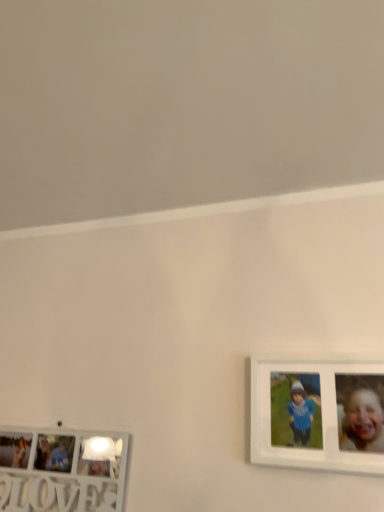
What do you see at coordinates (318, 414) in the screenshot?
I see `white matte picture frame at right, positioned as the 2th picture frame in bottom-to-top order` at bounding box center [318, 414].

Measure the distance between point (288, 449) and camera.

The depth of point (288, 449) is 1.00 meters.

In order to click on white matte picture frame at right, which ranks as the 1th picture frame in top-to-bottom order in this screenshot , I will do point(318,414).

How much space does white wooden picture frame at lower left, which is the first picture frame in left-to-right order, occupy vertically?

white wooden picture frame at lower left, which is the first picture frame in left-to-right order, is 24.23 centimeters tall.

The height and width of the screenshot is (512, 384). I want to click on white wooden picture frame at lower left, which is the first picture frame in left-to-right order, so click(62, 470).

What do you see at coordinates (62, 470) in the screenshot? I see `white wooden picture frame at lower left, which is the first picture frame in left-to-right order` at bounding box center [62, 470].

The height and width of the screenshot is (512, 384). In order to click on white matte picture frame at right, the 1th picture frame viewed from the right in this screenshot , I will do `click(318, 414)`.

Can you confirm if white wooden picture frame at lower left, which is the 2th picture frame from top to bottom, is positioned to the right of white matte picture frame at right, which ranks as the 1th picture frame in top-to-bottom order?

Incorrect, white wooden picture frame at lower left, which is the 2th picture frame from top to bottom, is not on the right side of white matte picture frame at right, which ranks as the 1th picture frame in top-to-bottom order.

Considering the positions of objects white wooden picture frame at lower left, which is the 1th picture frame from bottom to top, and white matte picture frame at right, positioned as the 2th picture frame in bottom-to-top order, in the image provided, who is in front, white wooden picture frame at lower left, which is the 1th picture frame from bottom to top, or white matte picture frame at right, positioned as the 2th picture frame in bottom-to-top order,?

white matte picture frame at right, positioned as the 2th picture frame in bottom-to-top order, is in front.

Which point is more distant from viewer, [0,440] or [312,436]?

The point [0,440] is behind.

From the image's perspective, which is above, white wooden picture frame at lower left, which is the first picture frame in left-to-right order, or white matte picture frame at right, the 1th picture frame viewed from the right?

white matte picture frame at right, the 1th picture frame viewed from the right, is shown above in the image.

From a real-world perspective, is white wooden picture frame at lower left, acting as the second picture frame starting from the right, physically located above or below white matte picture frame at right, which appears as the 2th picture frame when viewed from the left?

white wooden picture frame at lower left, acting as the second picture frame starting from the right, is situated lower than white matte picture frame at right, which appears as the 2th picture frame when viewed from the left, in the real world.

Between white wooden picture frame at lower left, acting as the second picture frame starting from the right, and white matte picture frame at right, which appears as the 2th picture frame when viewed from the left, which one has larger width?

white matte picture frame at right, which appears as the 2th picture frame when viewed from the left.

Considering the relative sizes of white wooden picture frame at lower left, acting as the second picture frame starting from the right, and white matte picture frame at right, which appears as the 2th picture frame when viewed from the left, in the image provided, is white wooden picture frame at lower left, acting as the second picture frame starting from the right, taller than white matte picture frame at right, which appears as the 2th picture frame when viewed from the left,?

Incorrect, the height of white wooden picture frame at lower left, acting as the second picture frame starting from the right, is not larger of that of white matte picture frame at right, which appears as the 2th picture frame when viewed from the left.

Does white wooden picture frame at lower left, which is the 1th picture frame from bottom to top, have a smaller size compared to white matte picture frame at right, positioned as the 2th picture frame in bottom-to-top order?

Incorrect, white wooden picture frame at lower left, which is the 1th picture frame from bottom to top, is not smaller in size than white matte picture frame at right, positioned as the 2th picture frame in bottom-to-top order.

Is white wooden picture frame at lower left, which is the first picture frame in left-to-right order, surrounding white matte picture frame at right, the 1th picture frame viewed from the right?

No, white matte picture frame at right, the 1th picture frame viewed from the right, is not surrounded by white wooden picture frame at lower left, which is the first picture frame in left-to-right order.

Are white wooden picture frame at lower left, which is the 1th picture frame from bottom to top, and white matte picture frame at right, the 1th picture frame viewed from the right, located far from each other?

white wooden picture frame at lower left, which is the 1th picture frame from bottom to top, is actually quite close to white matte picture frame at right, the 1th picture frame viewed from the right.

Does white wooden picture frame at lower left, which is the 2th picture frame from top to bottom, turn towards white matte picture frame at right, which ranks as the 1th picture frame in top-to-bottom order?

No, white wooden picture frame at lower left, which is the 2th picture frame from top to bottom, is not facing towards white matte picture frame at right, which ranks as the 1th picture frame in top-to-bottom order.

How far apart are white wooden picture frame at lower left, which is the 1th picture frame from bottom to top, and white matte picture frame at right, which ranks as the 1th picture frame in top-to-bottom order?

The distance of white wooden picture frame at lower left, which is the 1th picture frame from bottom to top, from white matte picture frame at right, which ranks as the 1th picture frame in top-to-bottom order, is 21.37 inches.

The image size is (384, 512). I want to click on picture frame behind the white matte picture frame at right, which ranks as the 1th picture frame in top-to-bottom order, so click(62, 470).

Between white matte picture frame at right, which ranks as the 1th picture frame in top-to-bottom order, and white wooden picture frame at lower left, which is the first picture frame in left-to-right order, which one appears on the right side from the viewer's perspective?

white matte picture frame at right, which ranks as the 1th picture frame in top-to-bottom order.

Relative to white wooden picture frame at lower left, which is the 2th picture frame from top to bottom, is white matte picture frame at right, the 1th picture frame viewed from the right, in front or behind?

white matte picture frame at right, the 1th picture frame viewed from the right, is positioned closer to the viewer than white wooden picture frame at lower left, which is the 2th picture frame from top to bottom.

Is point (327, 438) behind point (0, 484)?

No.

From the image's perspective, which is below, white matte picture frame at right, the 1th picture frame viewed from the right, or white wooden picture frame at lower left, which is the 1th picture frame from bottom to top?

white wooden picture frame at lower left, which is the 1th picture frame from bottom to top, is shown below in the image.

From a real-world perspective, is white matte picture frame at right, positioned as the 2th picture frame in bottom-to-top order, positioned above or below white wooden picture frame at lower left, which is the 2th picture frame from top to bottom?

From a real-world perspective, white matte picture frame at right, positioned as the 2th picture frame in bottom-to-top order, is physically above white wooden picture frame at lower left, which is the 2th picture frame from top to bottom.

Can you confirm if white matte picture frame at right, positioned as the 2th picture frame in bottom-to-top order, is wider than white wooden picture frame at lower left, which is the 1th picture frame from bottom to top?

Yes, white matte picture frame at right, positioned as the 2th picture frame in bottom-to-top order, is wider than white wooden picture frame at lower left, which is the 1th picture frame from bottom to top.

Is white matte picture frame at right, which ranks as the 1th picture frame in top-to-bottom order, shorter than white wooden picture frame at lower left, acting as the second picture frame starting from the right?

Incorrect, the height of white matte picture frame at right, which ranks as the 1th picture frame in top-to-bottom order, does not fall short of that of white wooden picture frame at lower left, acting as the second picture frame starting from the right.

Who is bigger, white matte picture frame at right, positioned as the 2th picture frame in bottom-to-top order, or white wooden picture frame at lower left, acting as the second picture frame starting from the right?

Bigger between the two is white wooden picture frame at lower left, acting as the second picture frame starting from the right.

Can white wooden picture frame at lower left, acting as the second picture frame starting from the right, be found inside white matte picture frame at right, the 1th picture frame viewed from the right?

Definitely not — white wooden picture frame at lower left, acting as the second picture frame starting from the right, is not inside white matte picture frame at right, the 1th picture frame viewed from the right.

Looking at this image, is the surface of white matte picture frame at right, which ranks as the 1th picture frame in top-to-bottom order, in direct contact with white wooden picture frame at lower left, which is the 1th picture frame from bottom to top?

white matte picture frame at right, which ranks as the 1th picture frame in top-to-bottom order, and white wooden picture frame at lower left, which is the 1th picture frame from bottom to top, are clearly separated.

Is white matte picture frame at right, which appears as the 2th picture frame when viewed from the left, aimed at white wooden picture frame at lower left, which is the first picture frame in left-to-right order?

No, white matte picture frame at right, which appears as the 2th picture frame when viewed from the left, is not turned towards white wooden picture frame at lower left, which is the first picture frame in left-to-right order.

How different are the orientations of white matte picture frame at right, which ranks as the 1th picture frame in top-to-bottom order, and white wooden picture frame at lower left, acting as the second picture frame starting from the right, in degrees?

The angular difference between white matte picture frame at right, which ranks as the 1th picture frame in top-to-bottom order, and white wooden picture frame at lower left, acting as the second picture frame starting from the right, is 0.0801 degrees.

The image size is (384, 512). Identify the location of picture frame behind the white matte picture frame at right, positioned as the 2th picture frame in bottom-to-top order. (62, 470).

The width and height of the screenshot is (384, 512). Find the location of `picture frame in front of the white wooden picture frame at lower left, acting as the second picture frame starting from the right`. picture frame in front of the white wooden picture frame at lower left, acting as the second picture frame starting from the right is located at coordinates (318, 414).

This screenshot has height=512, width=384. What are the coordinates of `picture frame lying above the white wooden picture frame at lower left, which is the first picture frame in left-to-right order (from the image's perspective)` in the screenshot? It's located at (318, 414).